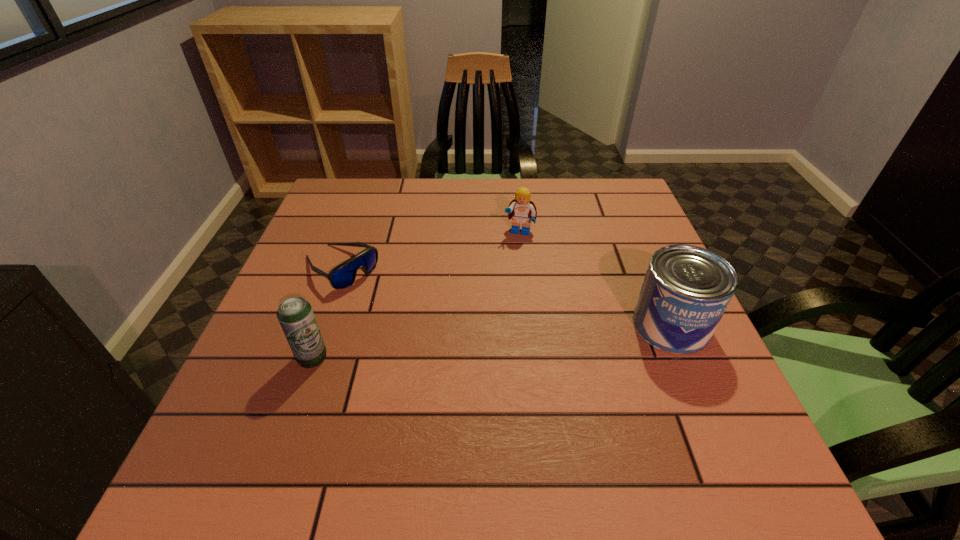
This screenshot has width=960, height=540. In the image, there is a desktop. What are the coordinates of `free region at the far left corner` in the screenshot? It's located at (352, 220).

The width and height of the screenshot is (960, 540). In the image, there is a desktop. Find the location of `vacant space at the far right corner`. vacant space at the far right corner is located at coordinates (594, 180).

Locate an element on the screen. This screenshot has width=960, height=540. empty location between the beer can and the rightmost object is located at coordinates (492, 341).

You are a GUI agent. You are given a task and a screenshot of the screen. Output one action in this format:
    pyautogui.click(x=<x>, y=<y>)
    Task: Click on the free area in between the second farthest object and the farthest object
    The image size is (960, 540).
    Given the screenshot: What is the action you would take?
    pyautogui.click(x=430, y=249)

Locate an element on the screen. This screenshot has height=540, width=960. vacant region between the beer can and the rightmost object is located at coordinates (492, 341).

At what (x,y) coordinates should I click in order to perform the action: click on blank region between the beer can and the third object from left to right. Please return your answer as a coordinate pair (x, y). This screenshot has width=960, height=540. Looking at the image, I should click on (416, 294).

Find the location of a particular element. free space between the third nearest object and the beer can is located at coordinates (326, 312).

Locate an element on the screen. Image resolution: width=960 pixels, height=540 pixels. free space between the third nearest object and the can is located at coordinates (506, 296).

This screenshot has height=540, width=960. I want to click on vacant area that lies between the Lego and the third nearest object, so click(430, 249).

You are a GUI agent. You are given a task and a screenshot of the screen. Output one action in this format:
    pyautogui.click(x=<x>, y=<y>)
    Task: Click on the free space between the farthest object and the sunglasses
    The height and width of the screenshot is (540, 960).
    Given the screenshot: What is the action you would take?
    pyautogui.click(x=430, y=249)